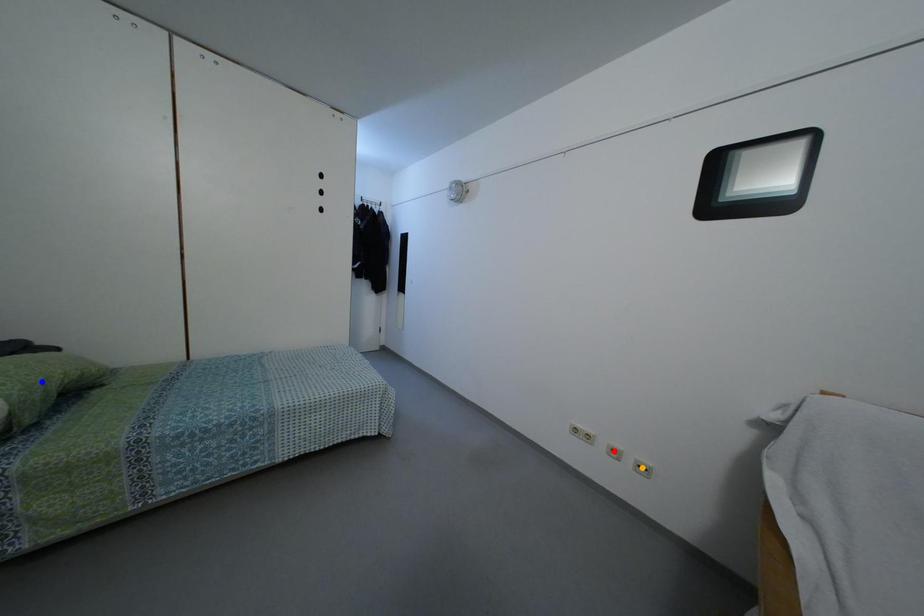
Order these from nearest to farthest:
1. red point
2. blue point
3. orange point

1. red point
2. orange point
3. blue point